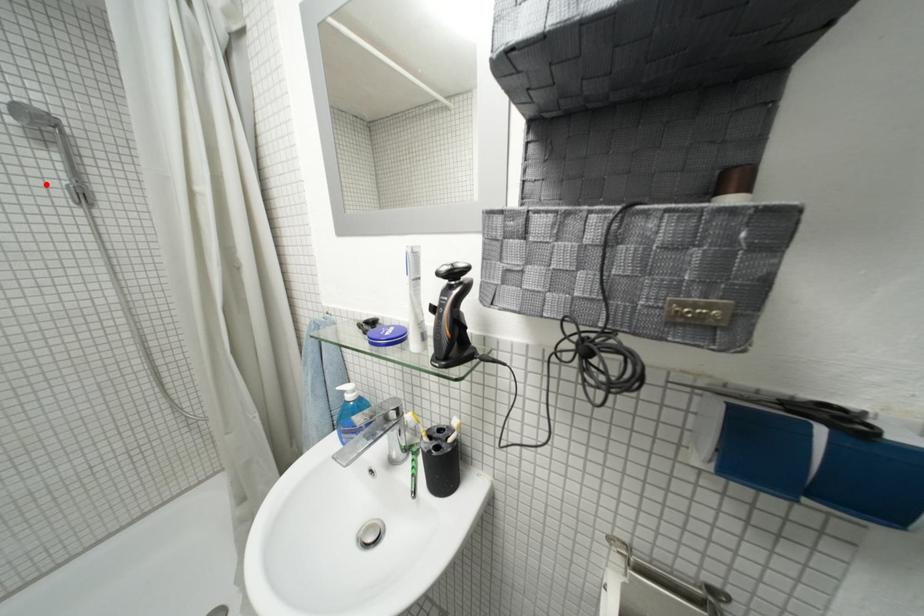
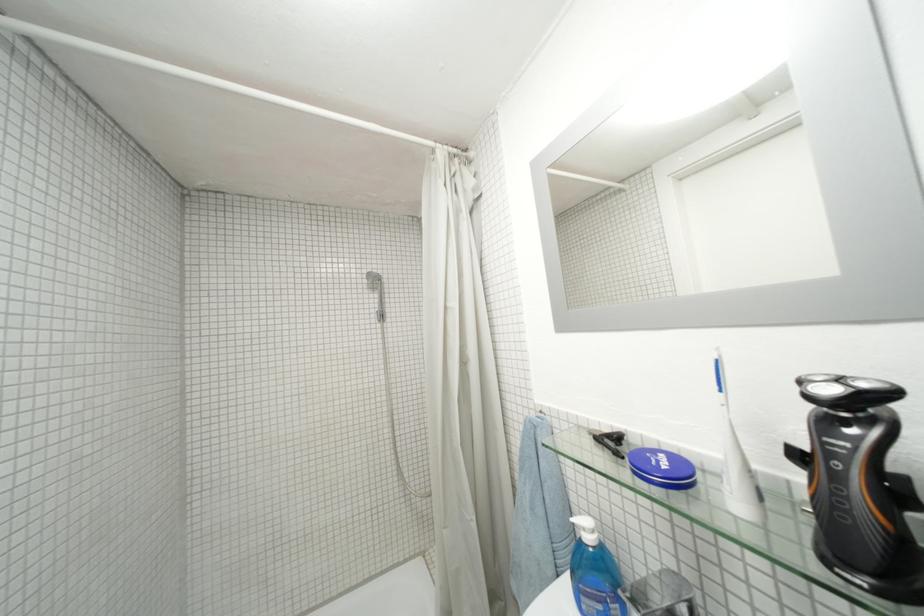
Locate, in the second image, the point that corresponds to the highlighted location in the first image.

(375, 314)